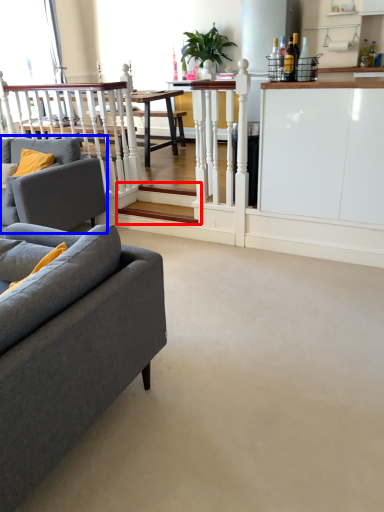
Question: Among these objects, which one is farthest to the camera, stairwell (highlighted by a red box) or studio couch (highlighted by a blue box)?

Choices:
 (A) stairwell
 (B) studio couch

Answer: (A)